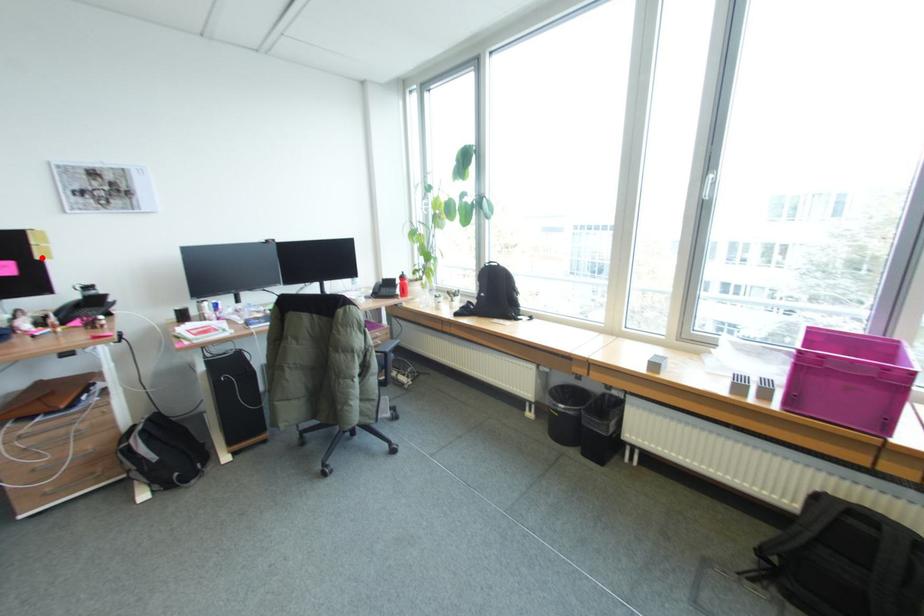
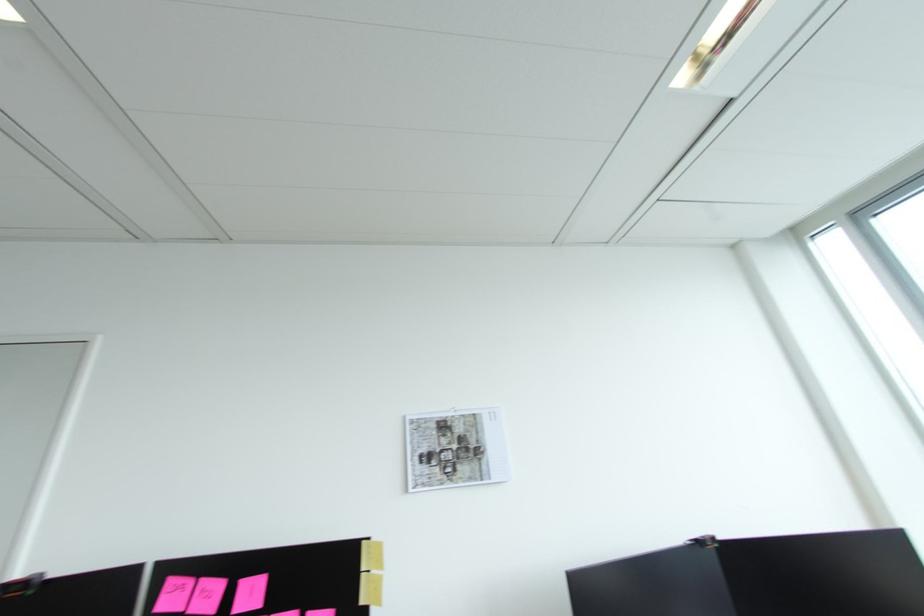
Where in the second image is the point corresponding to the highlighted location from the first image?

(366, 602)